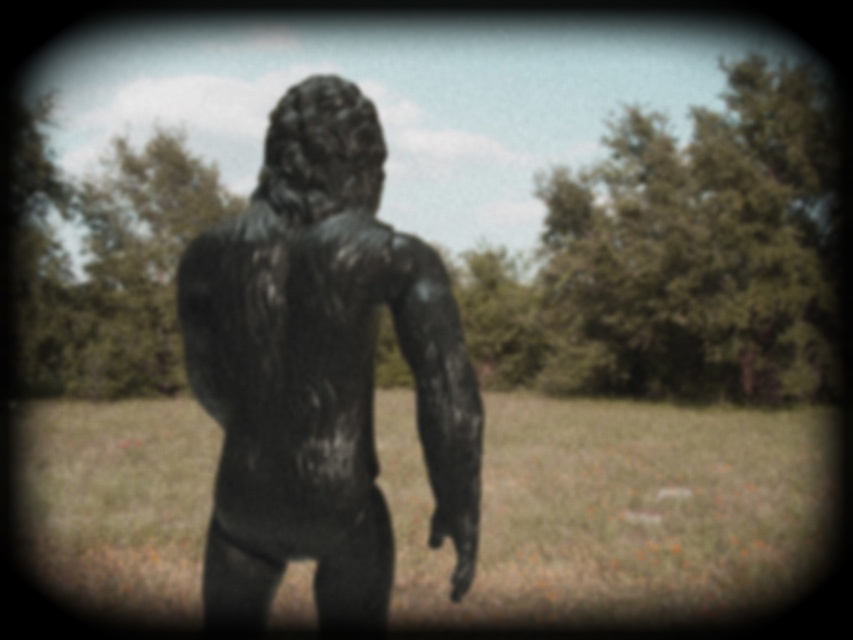
Can you confirm if green grass at center is positioned to the right of black matte statue at center?

No, green grass at center is not to the right of black matte statue at center.

Is point (671, 408) behind point (302, 468)?

Yes, point (671, 408) is farther from viewer.

The image size is (853, 640). Identify the location of green grass at center. (x=616, y=508).